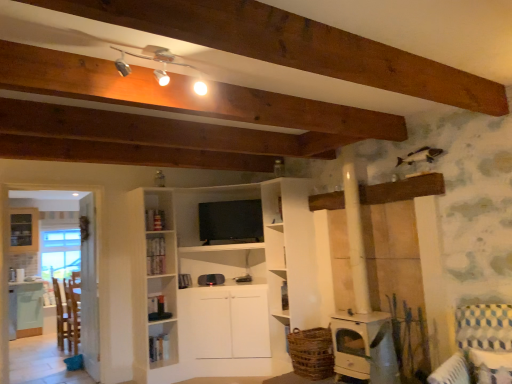
Question: Does silver metallic track lights at upper center have a larger size compared to wooden chair at left?

Choices:
 (A) no
 (B) yes

Answer: (A)

Question: From the image's perspective, does silver metallic track lights at upper center appear lower than wooden chair at left?

Choices:
 (A) yes
 (B) no

Answer: (B)

Question: From a real-world perspective, is silver metallic track lights at upper center below wooden chair at left?

Choices:
 (A) yes
 (B) no

Answer: (B)

Question: Is the depth of silver metallic track lights at upper center less than that of wooden chair at left?

Choices:
 (A) no
 (B) yes

Answer: (B)

Question: Is silver metallic track lights at upper center aimed at wooden chair at left?

Choices:
 (A) no
 (B) yes

Answer: (A)

Question: Can you confirm if silver metallic track lights at upper center is smaller than wooden chair at left?

Choices:
 (A) yes
 (B) no

Answer: (A)

Question: Does green matte table at lower left have a smaller size compared to silver metallic track lights at upper center?

Choices:
 (A) no
 (B) yes

Answer: (A)

Question: Does green matte table at lower left have a greater height compared to silver metallic track lights at upper center?

Choices:
 (A) no
 (B) yes

Answer: (B)

Question: Is green matte table at lower left facing towards silver metallic track lights at upper center?

Choices:
 (A) no
 (B) yes

Answer: (B)

Question: Is green matte table at lower left positioned before silver metallic track lights at upper center?

Choices:
 (A) no
 (B) yes

Answer: (A)

Question: Is green matte table at lower left placed right next to silver metallic track lights at upper center?

Choices:
 (A) yes
 (B) no

Answer: (B)

Question: Does green matte table at lower left appear on the right side of silver metallic track lights at upper center?

Choices:
 (A) yes
 (B) no

Answer: (B)

Question: Is silver metallic track lights at upper center in contact with blue and white checkered fabric armchair at lower right?

Choices:
 (A) yes
 (B) no

Answer: (B)